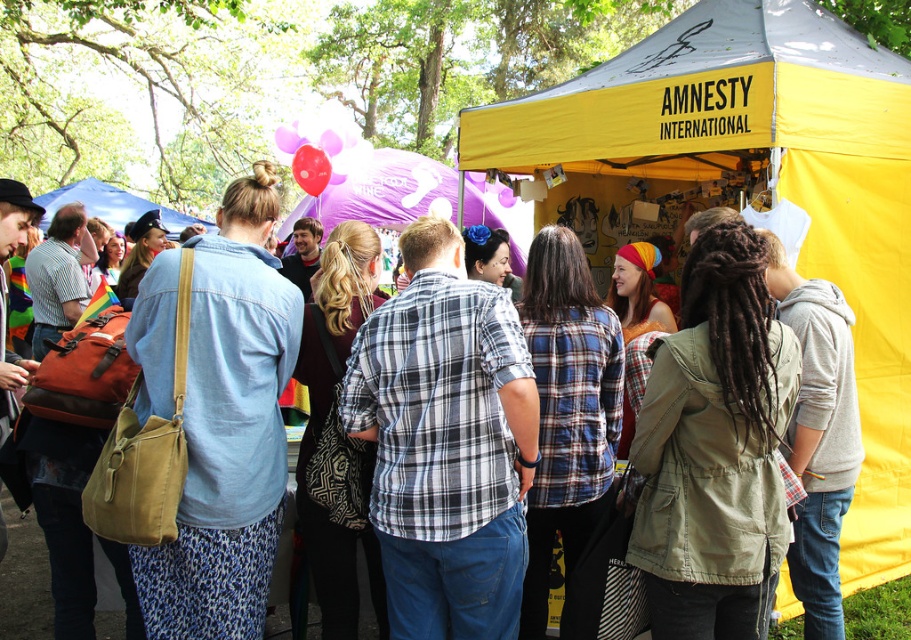
Is rubber balloon at upper center positioned behind matte blue tent at upper left?

That is False.

Does point (347, 150) come farther from viewer compared to point (64, 189)?

No, it is not.

You are a GUI agent. You are given a task and a screenshot of the screen. Output one action in this format:
    pyautogui.click(x=<x>, y=<y>)
    Task: Click on the rubber balloon at upper center
    
    Given the screenshot: What is the action you would take?
    pyautogui.click(x=320, y=148)

Which of these two, yellow fabric tent at center or matte blue tent at upper left, stands taller?

With more height is yellow fabric tent at center.

Between point (776, 64) and point (98, 205), which one is positioned in front?

Point (776, 64)

The height and width of the screenshot is (640, 911). In order to click on yellow fabric tent at center in this screenshot , I will do `click(755, 172)`.

Which of these two, purple fabric tent at center or matte blue tent at upper left, stands shorter?

matte blue tent at upper left is shorter.

Does purple fabric tent at center have a larger size compared to matte blue tent at upper left?

Correct, purple fabric tent at center is larger in size than matte blue tent at upper left.

Locate an element on the screen. purple fabric tent at center is located at coordinates (381, 193).